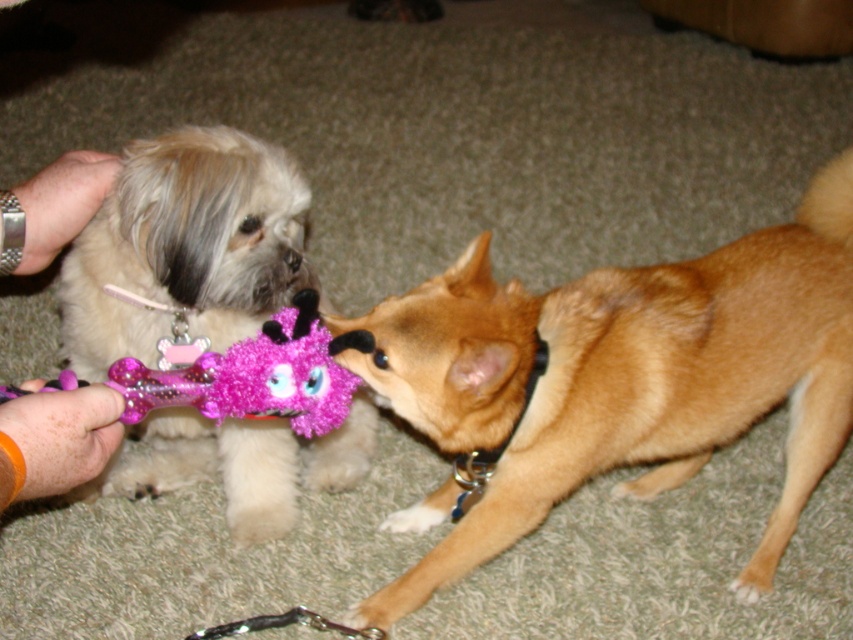
Question: Which point is farther to the camera?

Choices:
 (A) (283, 257)
 (B) (248, 148)

Answer: (A)

Question: Is shiny brown fur at center to the right of fuzzy glittery bone at center from the viewer's perspective?

Choices:
 (A) yes
 (B) no

Answer: (A)

Question: Does shiny brown fur at center appear on the right side of black fur nose at center?

Choices:
 (A) no
 (B) yes

Answer: (B)

Question: Which point is closer to the camera?

Choices:
 (A) (720, 429)
 (B) (285, 256)

Answer: (B)

Question: Which object is farther from the camera taking this photo?

Choices:
 (A) shiny brown fur at center
 (B) fuzzy glittery bone at center
 (C) smooth skin hand at upper left

Answer: (A)

Question: Can you confirm if shiny brown fur at center is thinner than fuzzy glittery bone at center?

Choices:
 (A) no
 (B) yes

Answer: (A)